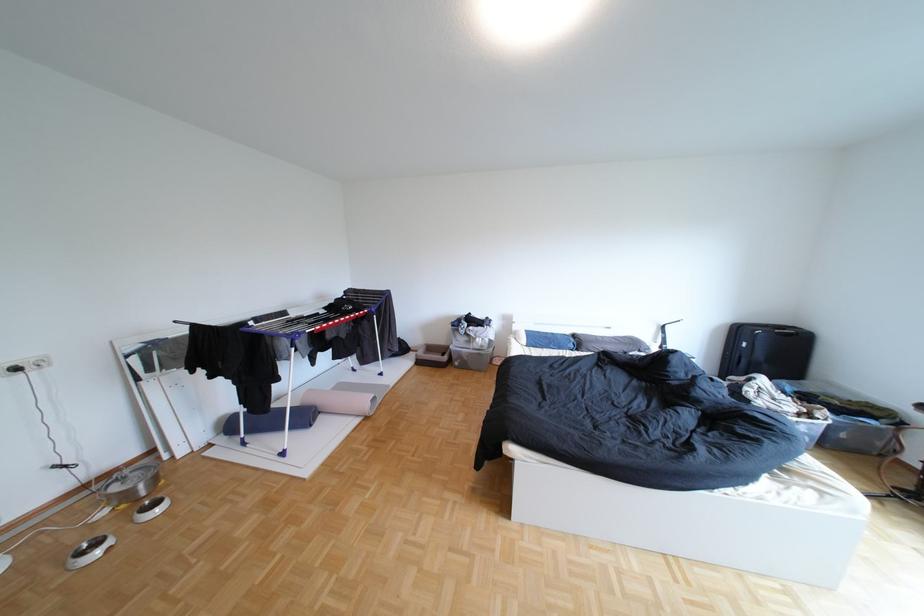
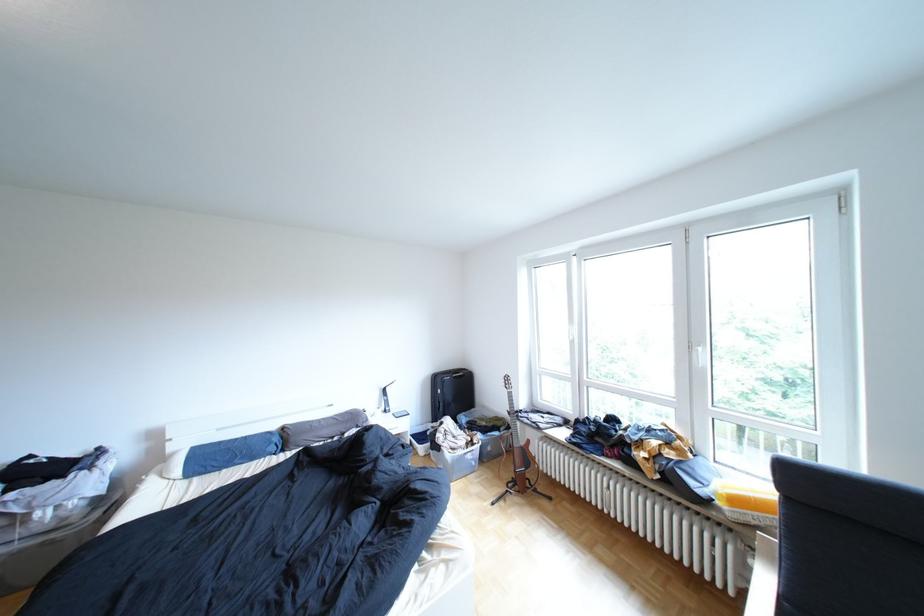
In the second image, find the point that corresponds to the point at 584,331 in the first image.

(289, 427)